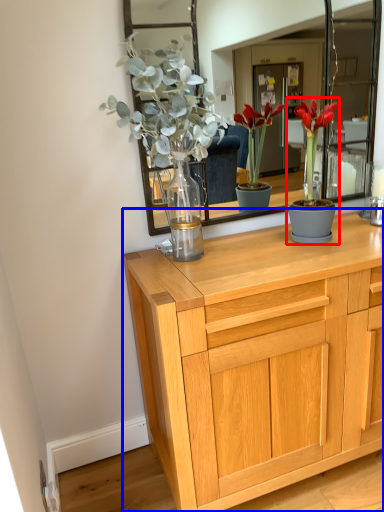
Question: Among these objects, which one is farthest to the camera, houseplant (highlighted by a red box) or chest of drawers (highlighted by a blue box)?

Choices:
 (A) houseplant
 (B) chest of drawers

Answer: (A)